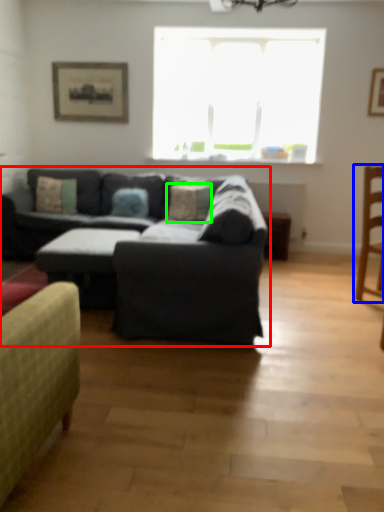
Question: Which is farther away from studio couch (highlighted by a red box)? chair (highlighted by a blue box) or pillow (highlighted by a green box)?

Choices:
 (A) chair
 (B) pillow

Answer: (B)